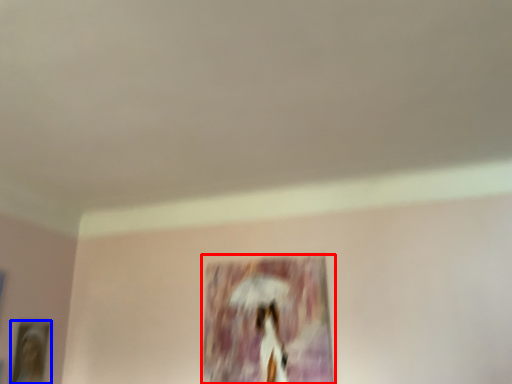
Question: Which object is further to the camera taking this photo, picture frame (highlighted by a red box) or picture frame (highlighted by a blue box)?

Choices:
 (A) picture frame
 (B) picture frame

Answer: (B)